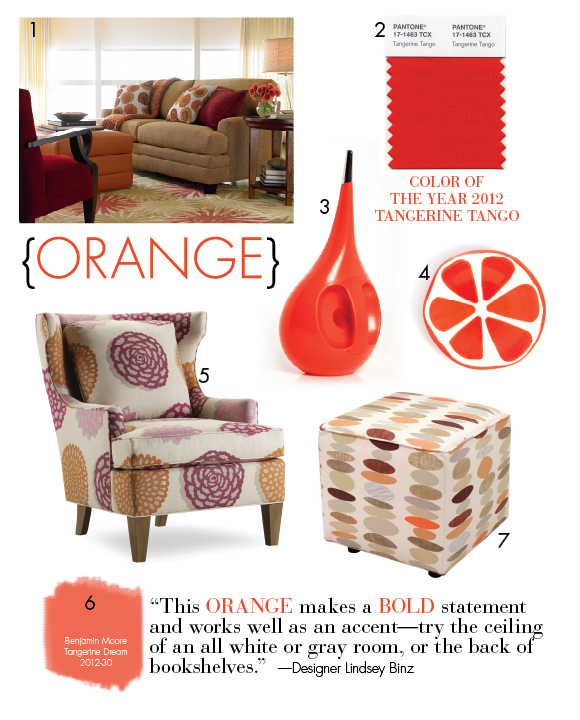
Find the location of `window`. window is located at coordinates (144, 62).